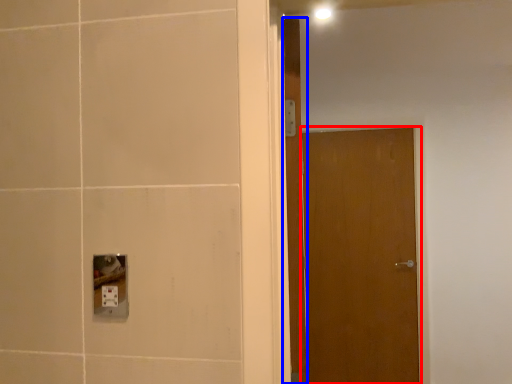
Question: Which point is further to the camera, door (highlighted by a red box) or door (highlighted by a blue box)?

Choices:
 (A) door
 (B) door

Answer: (A)